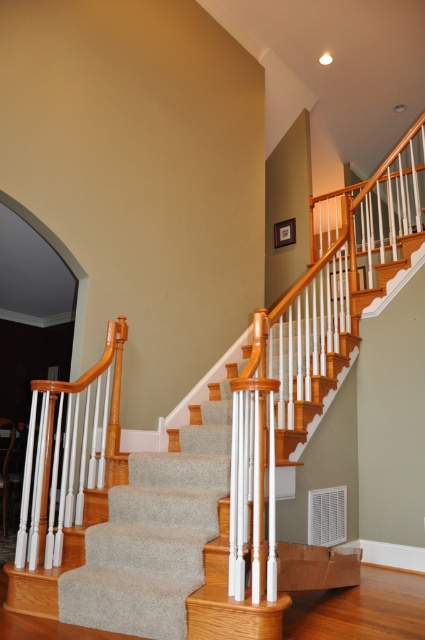
Is the position of carpeted stairs at center more distant than that of wooden handrail at center?

That is False.

Who is lower down, carpeted stairs at center or wooden handrail at center?

carpeted stairs at center

Who is more distant from viewer, (184,493) or (102,364)?

Point (102,364)

You are a GUI agent. You are given a task and a screenshot of the screen. Output one action in this format:
    pyautogui.click(x=<x>, y=<y>)
    Task: Click on the carpeted stairs at center
    This screenshot has height=640, width=425.
    Given the screenshot: What is the action you would take?
    pyautogui.click(x=184, y=545)